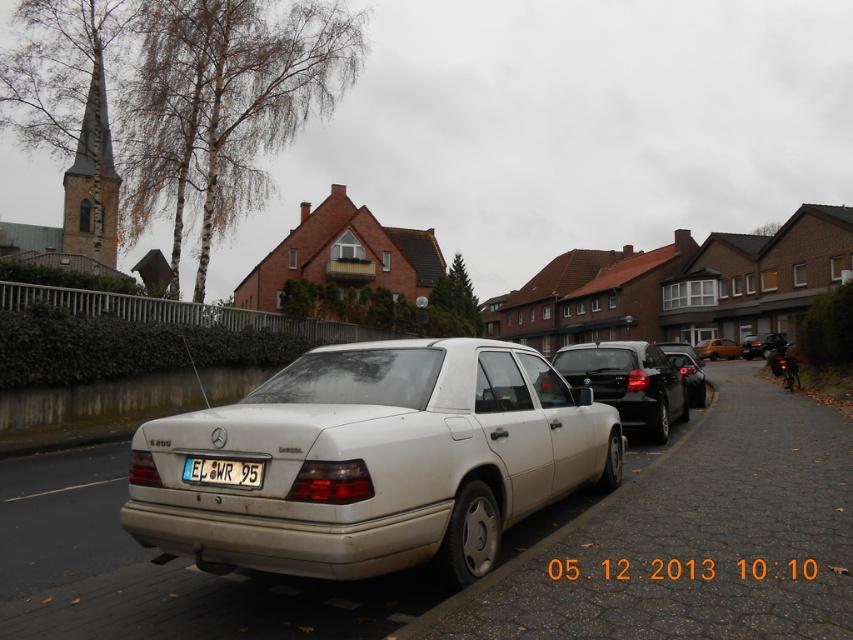
Question: From the image, what is the correct spatial relationship of white plastic license plate at center in relation to metallic silver sedan at center?

Choices:
 (A) above
 (B) below

Answer: (A)

Question: Can you confirm if satin black sedan at center is positioned below white concrete curb at lower center?

Choices:
 (A) no
 (B) yes

Answer: (A)

Question: Which point is closer to the camera taking this photo?

Choices:
 (A) coord(674,358)
 (B) coord(671,449)
 (C) coord(770,332)
 (D) coord(705,346)

Answer: (B)

Question: Is white concrete curb at lower center in front of glossy black car at right?

Choices:
 (A) yes
 (B) no

Answer: (A)

Question: Based on their relative distances, which object is farther from the satin black sedan at center?

Choices:
 (A) glossy black car at right
 (B) white plastic license plate at center
 (C) silver metallic sedan at center
 (D) matte black sedan at center

Answer: (D)

Question: Considering the real-world distances, which object is farthest from the shiny black sedan at center?

Choices:
 (A) silver metallic sedan at center
 (B) white plastic license plate at center
 (C) matte black sedan at center

Answer: (B)